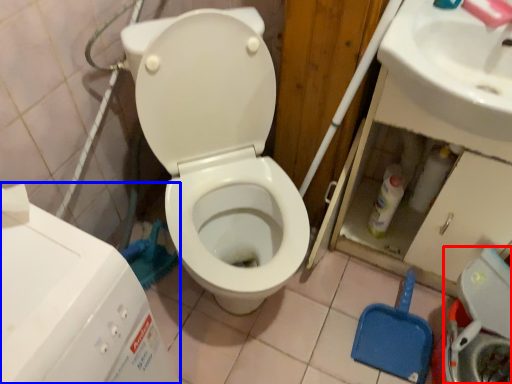
Question: Which point is closer to the camera, washer (highlighted by a red box) or water tank (highlighted by a blue box)?

Choices:
 (A) washer
 (B) water tank

Answer: (B)